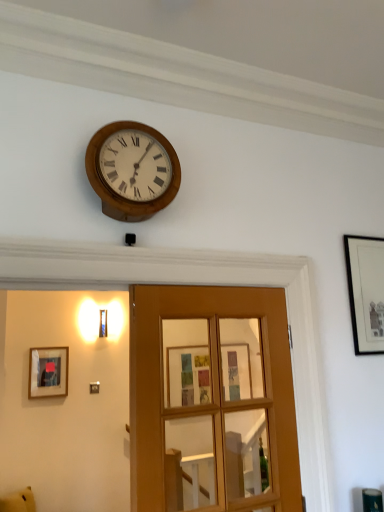
Question: Considering the relative positions of matte black picture frame at left, which is the 2th picture frame from right to left, and wooden glass door at center in the image provided, is matte black picture frame at left, which is the 2th picture frame from right to left, to the right of wooden glass door at center from the viewer's perspective?

Choices:
 (A) yes
 (B) no

Answer: (B)

Question: Could you tell me if matte black picture frame at left, placed as the second picture frame when sorted from front to back, is turned towards wooden glass door at center?

Choices:
 (A) yes
 (B) no

Answer: (A)

Question: Is matte black picture frame at left, placed as the second picture frame when sorted from front to back, facing away from wooden glass door at center?

Choices:
 (A) yes
 (B) no

Answer: (B)

Question: Is matte black picture frame at left, which is counted as the first picture frame, starting from the bottom, outside of wooden glass door at center?

Choices:
 (A) yes
 (B) no

Answer: (A)

Question: Does matte black picture frame at left, positioned as the first picture frame in left-to-right order, have a greater height compared to wooden glass door at center?

Choices:
 (A) yes
 (B) no

Answer: (B)

Question: Does wooden glass door at center turn towards black matte picture frame at upper right, which is the first picture frame from front to back?

Choices:
 (A) no
 (B) yes

Answer: (A)

Question: Is wooden glass door at center turned away from black matte picture frame at upper right, placed as the second picture frame when sorted from bottom to top?

Choices:
 (A) yes
 (B) no

Answer: (B)

Question: From a real-world perspective, is wooden glass door at center positioned over black matte picture frame at upper right, the first picture frame from the top, based on gravity?

Choices:
 (A) yes
 (B) no

Answer: (B)

Question: Is wooden glass door at center next to black matte picture frame at upper right, which is the first picture frame from front to back?

Choices:
 (A) yes
 (B) no

Answer: (B)

Question: From the image's perspective, does wooden glass door at center appear higher than black matte picture frame at upper right, placed as the second picture frame when sorted from bottom to top?

Choices:
 (A) yes
 (B) no

Answer: (B)

Question: Considering the relative positions of wooden glass door at center and black matte picture frame at upper right, which is the second picture frame from back to front, in the image provided, is wooden glass door at center to the right of black matte picture frame at upper right, which is the second picture frame from back to front, from the viewer's perspective?

Choices:
 (A) yes
 (B) no

Answer: (B)

Question: Does black matte picture frame at upper right, placed as the second picture frame when sorted from bottom to top, have a smaller size compared to wooden glass door at center?

Choices:
 (A) yes
 (B) no

Answer: (A)